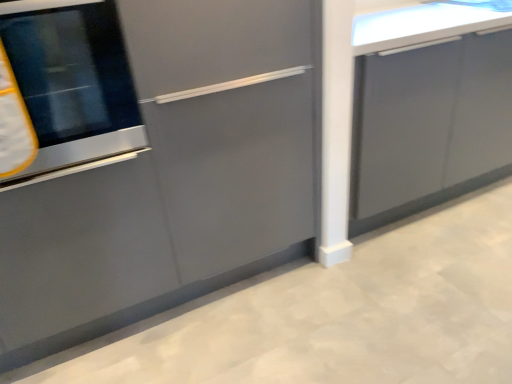
Question: Considering the positions of glossy gray cabinet at right, positioned as the second cabinetry in left-to-right order, and matte gray cabinet at left, which is the first cabinetry in left-to-right order, in the image, is glossy gray cabinet at right, positioned as the second cabinetry in left-to-right order, wider or thinner than matte gray cabinet at left, which is the first cabinetry in left-to-right order,?

Choices:
 (A) wide
 (B) thin

Answer: (B)

Question: From the image's perspective, is glossy gray cabinet at right, placed as the 1th cabinetry when sorted from right to left, above or below matte gray cabinet at left, which is the first cabinetry in left-to-right order?

Choices:
 (A) below
 (B) above

Answer: (B)

Question: Which object is positioned closest to the glossy gray cabinet at right, placed as the 1th cabinetry when sorted from right to left?

Choices:
 (A) matte gray cabinet at left, which is the first cabinetry in left-to-right order
 (B) stainless steel oven at left

Answer: (A)

Question: Estimate the real-world distances between objects in this image. Which object is farther from the stainless steel oven at left?

Choices:
 (A) glossy gray cabinet at right, placed as the 1th cabinetry when sorted from right to left
 (B) matte gray cabinet at left, acting as the 2th cabinetry starting from the right

Answer: (A)